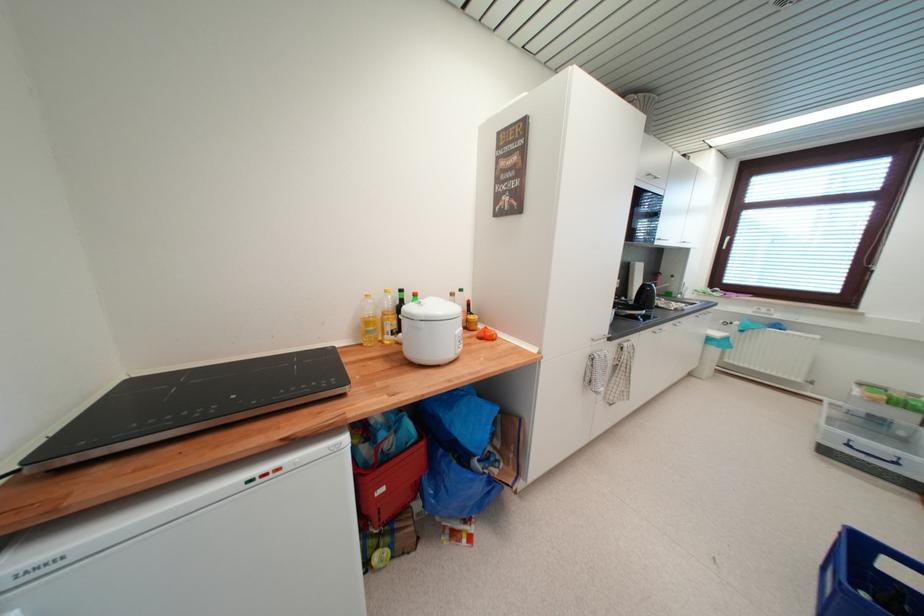
At what (x,y) coordinates should I click in order to perform the action: click on black kettle handle. Please return your answer as a coordinate pair (x, y). Looking at the image, I should click on (643, 293).